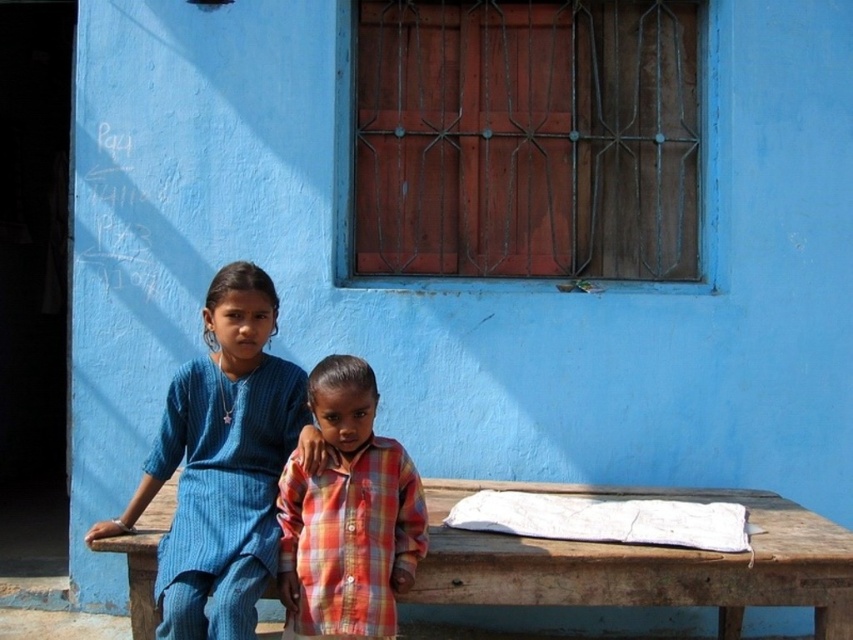
Question: Does blue textured dress at center appear on the right side of wooden picnic table at lower center?

Choices:
 (A) yes
 (B) no

Answer: (B)

Question: Estimate the real-world distances between objects in this image. Which object is closer to the wooden picnic table at lower center?

Choices:
 (A) blue textured dress at center
 (B) plaid fabric shirt at center

Answer: (B)

Question: Which point is closer to the camera?

Choices:
 (A) (624, 584)
 (B) (233, 541)

Answer: (B)

Question: Among these points, which one is farthest from the camera?

Choices:
 (A) (421, 529)
 (B) (181, 589)

Answer: (A)

Question: Is blue textured dress at center above wooden picnic table at lower center?

Choices:
 (A) no
 (B) yes

Answer: (B)

Question: Can you confirm if blue textured dress at center is positioned below plaid fabric shirt at center?

Choices:
 (A) yes
 (B) no

Answer: (B)